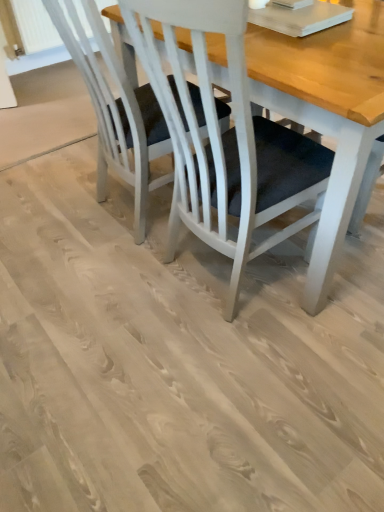
Image resolution: width=384 pixels, height=512 pixels. I want to click on vacant space underneath wooden table at center (from a real-world perspective), so click(x=222, y=279).